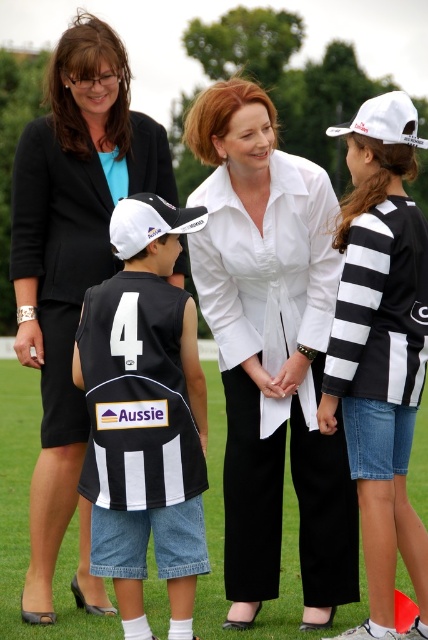
Question: Where is white smooth shirt at center located in relation to white matte baseball cap at center-left in the image?

Choices:
 (A) below
 (B) above

Answer: (A)

Question: Can you confirm if matte black blazer at upper left is positioned above black jersey at center?

Choices:
 (A) no
 (B) yes

Answer: (B)

Question: Is white smooth shirt at center positioned in front of black jersey at center?

Choices:
 (A) no
 (B) yes

Answer: (A)

Question: Based on their relative distances, which object is farther from the matte black blazer at upper left?

Choices:
 (A) black and white striped shirt at right
 (B) black jersey at center
 (C) white matte baseball cap at upper right
 (D) white matte baseball cap at center-left

Answer: (C)

Question: Among these objects, which one is nearest to the camera?

Choices:
 (A) black jersey at center
 (B) black and white striped shirt at right
 (C) white matte baseball cap at center-left

Answer: (B)

Question: Estimate the real-world distances between objects in this image. Which object is farther from the black and white striped shirt at right?

Choices:
 (A) white matte baseball cap at upper right
 (B) white smooth shirt at center
 (C) matte black blazer at upper left
 (D) white matte baseball cap at center-left

Answer: (A)